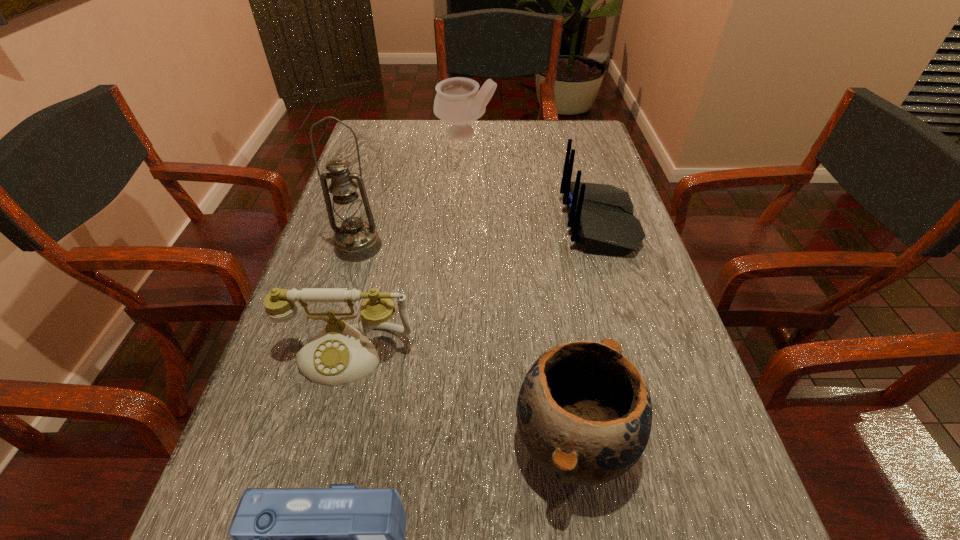
Identify the location of vacant space positioned on the back of the router. (449, 224).

Locate an element on the screen. vacant space located on the back of the router is located at coordinates (498, 224).

Where is `free space located on the back of the second nearest object`? free space located on the back of the second nearest object is located at coordinates (x=553, y=312).

Find the location of a particular element. The image size is (960, 540). free space located on the dial of the telephone is located at coordinates (324, 455).

Find the location of a particular element. Image resolution: width=960 pixels, height=540 pixels. object located in the far edge section of the desktop is located at coordinates (x=458, y=101).

You are a GUI agent. You are given a task and a screenshot of the screen. Output one action in this format:
    pyautogui.click(x=<x>, y=<y>)
    Task: Click on the oil lamp positioned at the left edge
    The width and height of the screenshot is (960, 540).
    Given the screenshot: What is the action you would take?
    pyautogui.click(x=355, y=240)

This screenshot has height=540, width=960. I want to click on telephone positioned at the left edge, so click(339, 354).

Find the location of `router located in the right edge section of the desktop`. router located in the right edge section of the desktop is located at coordinates (601, 217).

Identify the location of pottery present at the right edge. (584, 412).

I want to click on free spot at the far edge of the desktop, so click(470, 154).